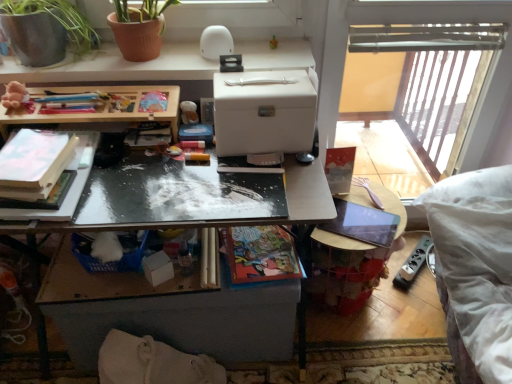
Question: Can you confirm if white matte desk at upper center is positioned to the right of wooden table at center, marked as the 2th table in a top-to-bottom arrangement?

Choices:
 (A) no
 (B) yes

Answer: (A)

Question: From a real-world perspective, is white matte desk at upper center on top of wooden table at center, which ranks as the first table in bottom-to-top order?

Choices:
 (A) yes
 (B) no

Answer: (A)

Question: Does white matte desk at upper center have a greater height compared to wooden table at center, which ranks as the first table in bottom-to-top order?

Choices:
 (A) yes
 (B) no

Answer: (B)

Question: Are white matte desk at upper center and wooden table at center, which ranks as the first table in bottom-to-top order, located far from each other?

Choices:
 (A) yes
 (B) no

Answer: (B)

Question: Is wooden table at center, which ranks as the first table in bottom-to-top order, located within white matte desk at upper center?

Choices:
 (A) no
 (B) yes

Answer: (A)

Question: Is white matte desk at upper center oriented away from wooden table at center, which ranks as the first table in bottom-to-top order?

Choices:
 (A) no
 (B) yes

Answer: (A)

Question: From the image's perspective, is terracotta clay pot at upper left beneath wooden at upper left, marked as the second table in a bottom-to-top arrangement?

Choices:
 (A) no
 (B) yes

Answer: (A)

Question: Is terracotta clay pot at upper left not near wooden at upper left, the 1th table from the top?

Choices:
 (A) yes
 (B) no

Answer: (B)

Question: From a real-world perspective, is terracotta clay pot at upper left on wooden at upper left, the 1th table from the top?

Choices:
 (A) no
 (B) yes

Answer: (B)

Question: From a real-world perspective, is terracotta clay pot at upper left physically below wooden at upper left, the 1th table from the top?

Choices:
 (A) yes
 (B) no

Answer: (B)

Question: Is terracotta clay pot at upper left wider than wooden at upper left, marked as the second table in a bottom-to-top arrangement?

Choices:
 (A) no
 (B) yes

Answer: (B)

Question: Does terracotta clay pot at upper left lie behind wooden at upper left, marked as the second table in a bottom-to-top arrangement?

Choices:
 (A) no
 (B) yes

Answer: (B)

Question: Could you tell me if matte paper book at center, which is the third book from left to right, is facing matte white book at left, the third book positioned from the right?

Choices:
 (A) yes
 (B) no

Answer: (B)